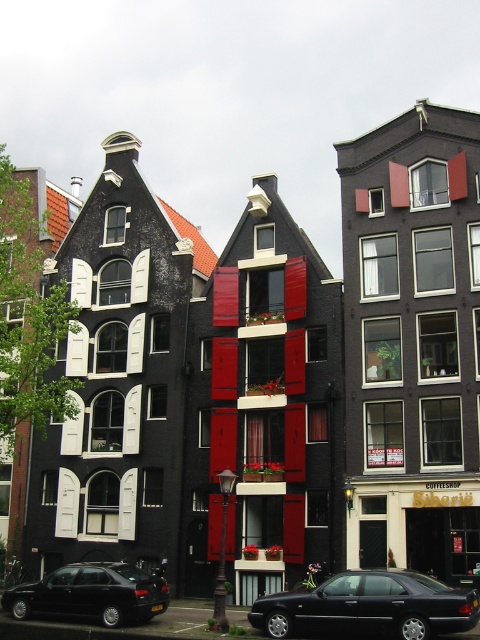
Question: In this image, where is shiny black sedan at center located relative to shiny black sedan at lower left?

Choices:
 (A) right
 (B) left

Answer: (A)

Question: From the image, what is the correct spatial relationship of shiny black sedan at center in relation to shiny black sedan at lower left?

Choices:
 (A) right
 (B) left

Answer: (A)

Question: Which point is farther from the camera taking this photo?

Choices:
 (A) (2, 605)
 (B) (369, 612)

Answer: (A)

Question: Does shiny black sedan at center appear on the right side of shiny black sedan at lower left?

Choices:
 (A) yes
 (B) no

Answer: (A)

Question: Which point is farther to the camera?

Choices:
 (A) (147, 584)
 (B) (415, 634)

Answer: (A)